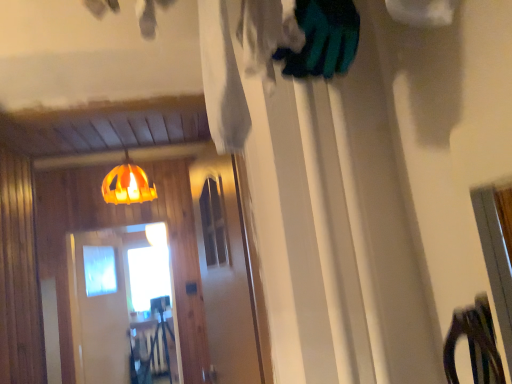
The image size is (512, 384). Find the location of `orange fabric lampshade at upper center`. orange fabric lampshade at upper center is located at coordinates (127, 184).

Image resolution: width=512 pixels, height=384 pixels. Find the location of `transparent plastic screen door at center, the 1th screen door positioned from the back`. transparent plastic screen door at center, the 1th screen door positioned from the back is located at coordinates (122, 305).

From a real-world perspective, relative to transparent plastic screen door at center, the 1th screen door positioned from the back, is orange fabric lampshade at upper center vertically above or below?

In terms of real-world spatial position, orange fabric lampshade at upper center is above transparent plastic screen door at center, the 1th screen door positioned from the back.

Which of these two, orange fabric lampshade at upper center or transparent plastic screen door at center, the 1th screen door positioned from the back, stands taller?

transparent plastic screen door at center, the 1th screen door positioned from the back, is taller.

Looking at this image, is orange fabric lampshade at upper center touching transparent plastic screen door at center, which is counted as the 1th screen door, starting from the left?

No, orange fabric lampshade at upper center is not next to transparent plastic screen door at center, which is counted as the 1th screen door, starting from the left.

Can transparent plastic screen door at center, the 1th screen door positioned from the back, be found inside orange fabric lampshade at upper center?

No.

Is transparent glass screen door at center, acting as the second screen door starting from the left, far from transparent plastic screen door at center, the 1th screen door positioned from the back?

Yes, transparent glass screen door at center, acting as the second screen door starting from the left, and transparent plastic screen door at center, the 1th screen door positioned from the back, are quite far apart.

From the picture: Measure the distance from transparent glass screen door at center, which is counted as the 2th screen door, starting from the back, to transparent plastic screen door at center, the second screen door positioned from the right.

A distance of 6.67 feet exists between transparent glass screen door at center, which is counted as the 2th screen door, starting from the back, and transparent plastic screen door at center, the second screen door positioned from the right.

From the image's perspective, is transparent glass screen door at center, positioned as the 1th screen door in front-to-back order, over transparent plastic screen door at center, the second screen door positioned from the right?

Yes, from the image's perspective, transparent glass screen door at center, positioned as the 1th screen door in front-to-back order, is above transparent plastic screen door at center, the second screen door positioned from the right.

Who is smaller, transparent glass screen door at center, acting as the second screen door starting from the left, or transparent plastic screen door at center, the 1th screen door positioned from the back?

transparent glass screen door at center, acting as the second screen door starting from the left, is smaller.

Are transparent plastic screen door at center, the second screen door positioned from the right, and orange fabric lampshade at upper center beside each other?

No, transparent plastic screen door at center, the second screen door positioned from the right, is not next to orange fabric lampshade at upper center.

There is a orange fabric lampshade at upper center. Identify the location of the 2nd screen door below it (from a real-world perspective). (122, 305).

Is transparent plastic screen door at center, the second screen door positioned from the right, inside or outside of orange fabric lampshade at upper center?

transparent plastic screen door at center, the second screen door positioned from the right, lies outside orange fabric lampshade at upper center.

How many degrees apart are the facing directions of transparent plastic screen door at center, which is the 2th screen door in front-to-back order, and transparent glass screen door at center, positioned as the 1th screen door in front-to-back order?

The angle between the facing direction of transparent plastic screen door at center, which is the 2th screen door in front-to-back order, and the facing direction of transparent glass screen door at center, positioned as the 1th screen door in front-to-back order, is 79.5 degrees.

Considering the sizes of objects transparent plastic screen door at center, which is the 2th screen door in front-to-back order, and transparent glass screen door at center, the first screen door in the right-to-left sequence, in the image provided, who is bigger, transparent plastic screen door at center, which is the 2th screen door in front-to-back order, or transparent glass screen door at center, the first screen door in the right-to-left sequence,?

transparent plastic screen door at center, which is the 2th screen door in front-to-back order.

Between transparent plastic screen door at center, which is the 2th screen door in front-to-back order, and transparent glass screen door at center, which is counted as the 2th screen door, starting from the back, which one has less height?

transparent glass screen door at center, which is counted as the 2th screen door, starting from the back, is shorter.

Considering the relative sizes of orange fabric lampshade at upper center and transparent glass screen door at center, which is counted as the 2th screen door, starting from the back, in the image provided, is orange fabric lampshade at upper center smaller than transparent glass screen door at center, which is counted as the 2th screen door, starting from the back,?

Yes.

Which object is thinner, orange fabric lampshade at upper center or transparent glass screen door at center, the first screen door in the right-to-left sequence?

transparent glass screen door at center, the first screen door in the right-to-left sequence.

Who is taller, orange fabric lampshade at upper center or transparent glass screen door at center, the first screen door in the right-to-left sequence?

transparent glass screen door at center, the first screen door in the right-to-left sequence.

From the image's perspective, who appears lower, orange fabric lampshade at upper center or transparent glass screen door at center, which is counted as the 2th screen door, starting from the back?

transparent glass screen door at center, which is counted as the 2th screen door, starting from the back.

Is transparent glass screen door at center, the first screen door in the right-to-left sequence, oriented towards orange fabric lampshade at upper center?

No, transparent glass screen door at center, the first screen door in the right-to-left sequence, is not facing towards orange fabric lampshade at upper center.

Which is correct: transparent glass screen door at center, acting as the second screen door starting from the left, is inside orange fabric lampshade at upper center, or outside of it?

transparent glass screen door at center, acting as the second screen door starting from the left, is spatially situated outside orange fabric lampshade at upper center.

From a real-world perspective, is transparent glass screen door at center, which is counted as the 2th screen door, starting from the back, positioned above or below orange fabric lampshade at upper center?

In terms of real-world spatial position, transparent glass screen door at center, which is counted as the 2th screen door, starting from the back, is below orange fabric lampshade at upper center.

In terms of height, does transparent glass screen door at center, which is counted as the 2th screen door, starting from the back, look taller or shorter compared to orange fabric lampshade at upper center?

In the image, transparent glass screen door at center, which is counted as the 2th screen door, starting from the back, appears to be taller than orange fabric lampshade at upper center.

Where is `lamp above the transparent plastic screen door at center, which is counted as the 1th screen door, starting from the left (from a real-world perspective)`? The width and height of the screenshot is (512, 384). lamp above the transparent plastic screen door at center, which is counted as the 1th screen door, starting from the left (from a real-world perspective) is located at coordinates (127, 184).

The width and height of the screenshot is (512, 384). In order to click on screen door that appears below the transparent glass screen door at center, acting as the second screen door starting from the left (from the image's perspective) in this screenshot , I will do `click(122, 305)`.

Estimate the real-world distances between objects in this image. Which object is closer to transparent glass screen door at center, acting as the second screen door starting from the left, orange fabric lampshade at upper center or transparent plastic screen door at center, which is counted as the 1th screen door, starting from the left?

Among the two, orange fabric lampshade at upper center is located nearer to transparent glass screen door at center, acting as the second screen door starting from the left.

When comparing their distances from transparent plastic screen door at center, the second screen door positioned from the right, does transparent glass screen door at center, positioned as the 1th screen door in front-to-back order, or orange fabric lampshade at upper center seem further?

transparent glass screen door at center, positioned as the 1th screen door in front-to-back order.

Considering their positions, is orange fabric lampshade at upper center positioned closer to transparent plastic screen door at center, which is counted as the 1th screen door, starting from the left, than transparent glass screen door at center, positioned as the 1th screen door in front-to-back order?

Based on the image, orange fabric lampshade at upper center appears to be nearer to transparent plastic screen door at center, which is counted as the 1th screen door, starting from the left.

Considering their positions, is transparent plastic screen door at center, the 1th screen door positioned from the back, positioned further to transparent glass screen door at center, acting as the second screen door starting from the left, than orange fabric lampshade at upper center?

transparent plastic screen door at center, the 1th screen door positioned from the back, lies further to transparent glass screen door at center, acting as the second screen door starting from the left, than the other object.

Based on their spatial positions, is transparent plastic screen door at center, the second screen door positioned from the right, or transparent glass screen door at center, positioned as the 1th screen door in front-to-back order, further from orange fabric lampshade at upper center?

Based on the image, transparent glass screen door at center, positioned as the 1th screen door in front-to-back order, appears to be further to orange fabric lampshade at upper center.

Looking at the image, which one is located further to orange fabric lampshade at upper center, transparent glass screen door at center, the first screen door in the right-to-left sequence, or transparent plastic screen door at center, which is counted as the 1th screen door, starting from the left?

transparent glass screen door at center, the first screen door in the right-to-left sequence.

Find the location of a particular element. lamp between transparent glass screen door at center, positioned as the 1th screen door in front-to-back order, and transparent plastic screen door at center, the 1th screen door positioned from the back, from front to back is located at coordinates (127, 184).